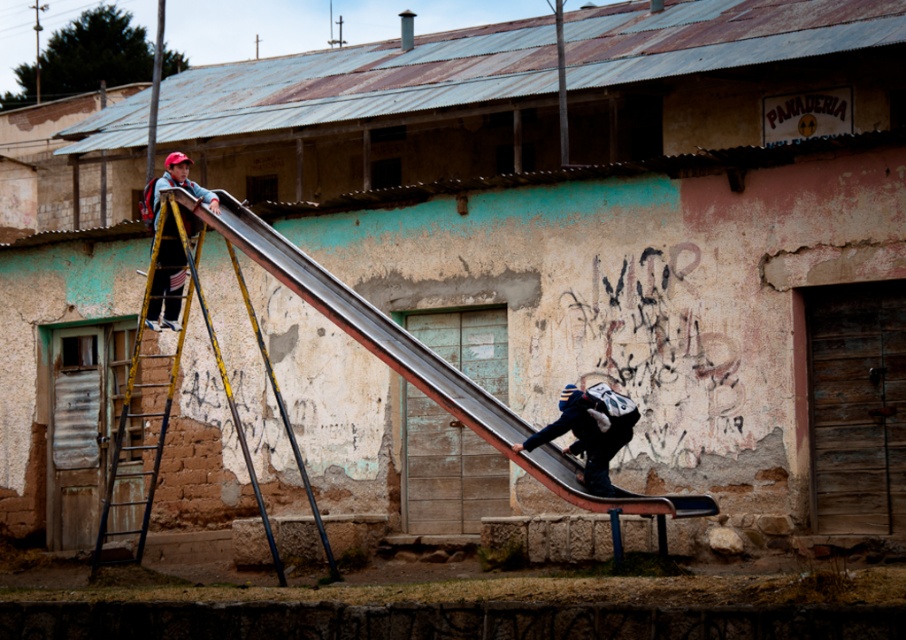
You are standing in front of the building with the metal slide. There are two points marked on the slide. One is at coordinate point (140,545) and the other is at point (625,438). Which point is closer to you?

Point (140,545) is closer to you because it is further to the viewer than point (625,438).

You are a parent trying to ensure your child can safely climb the yellow metal ladder at upper left while avoiding the dark blue fabric backpack at lower right. Based on the scene, which object is taller and therefore poses a potential climbing obstacle?

The yellow metal ladder at upper left is taller than the dark blue fabric backpack at lower right, so the ladder itself may pose a climbing obstacle due to its height.

Based on the photo, you are a painter who needs to choose between two ladders to paint the building. The yellow metal ladder at upper left and the matte yellow ladder at left are available. Which ladder is wider and more suitable for carrying painting supplies?

The yellow metal ladder at upper left is wider than the matte yellow ladder at left, making it more suitable for carrying painting supplies.